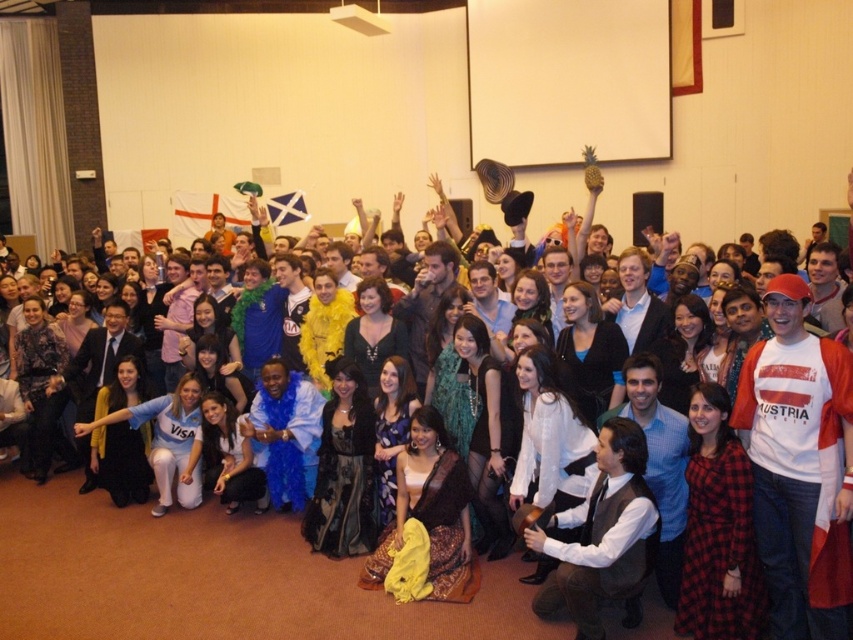
Question: Which point is closer to the camera?

Choices:
 (A) 457,380
 (B) 432,486
 (C) 358,476
 (D) 697,512

Answer: (D)

Question: Which point is farther to the camera?

Choices:
 (A) red plaid dress at lower right
 (B) white shirt at center
 (C) yellow sheer fabric at center
 (D) teal sequined dress at center

Answer: (D)

Question: Which object appears farthest from the camera in this image?

Choices:
 (A) yellow sheer fabric at center
 (B) teal sequined dress at center
 (C) black satin dress at center
 (D) red plaid dress at lower right

Answer: (B)

Question: Is black satin dress at center bigger than teal sequined dress at center?

Choices:
 (A) yes
 (B) no

Answer: (A)

Question: Can you confirm if white shirt at center is wider than black satin dress at center?

Choices:
 (A) no
 (B) yes

Answer: (B)

Question: Can you confirm if white shirt at center is bigger than black satin dress at center?

Choices:
 (A) no
 (B) yes

Answer: (B)